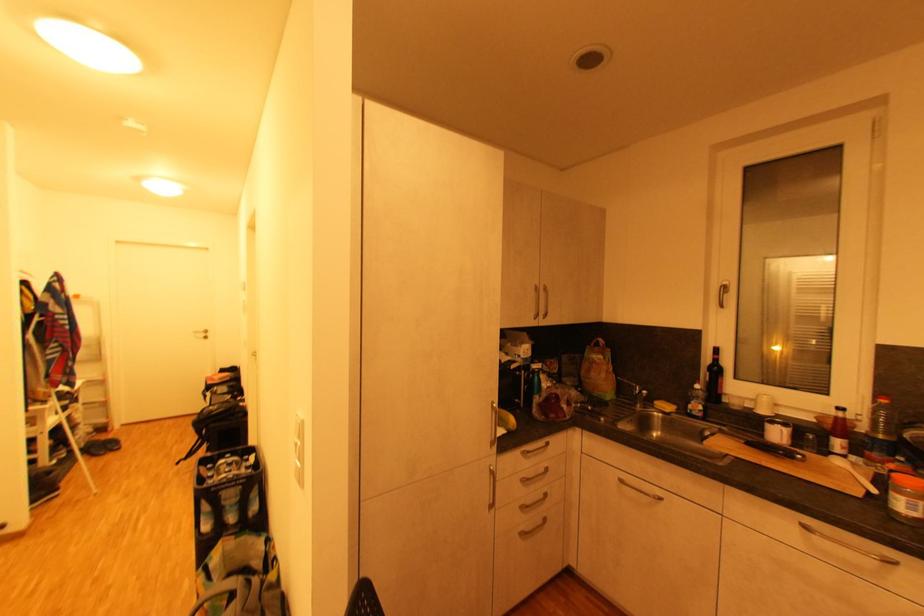
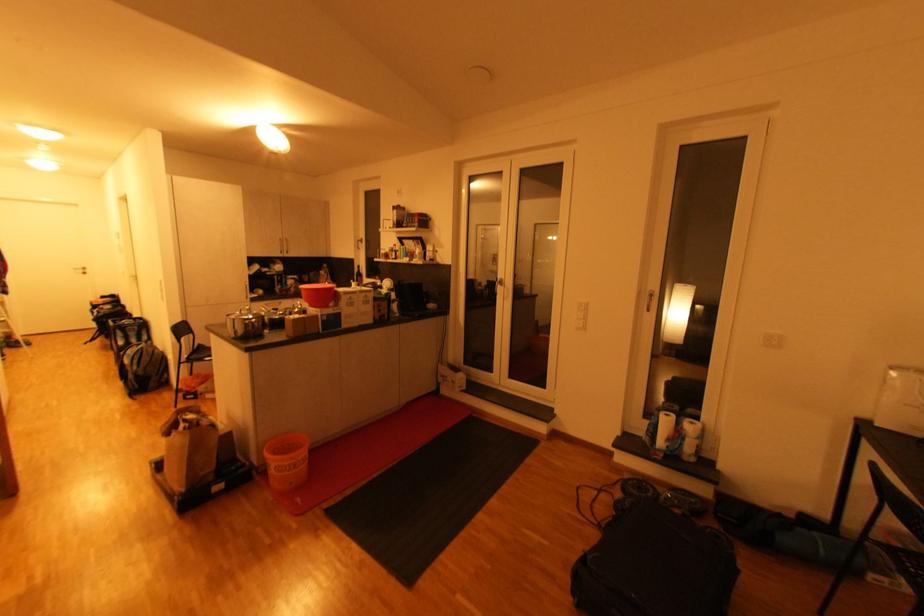
Where in the second image is the point corresponding to [541,318] from the first image?

(286, 254)